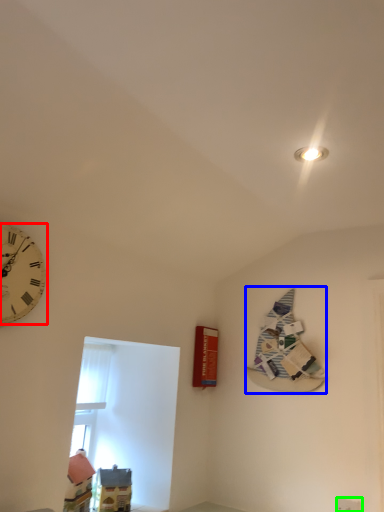
Question: Which object is the closest to the wall clock (highlighted by a red box)? Choose among these: book (highlighted by a blue box) or electric outlet (highlighted by a green box).

Choices:
 (A) book
 (B) electric outlet

Answer: (A)